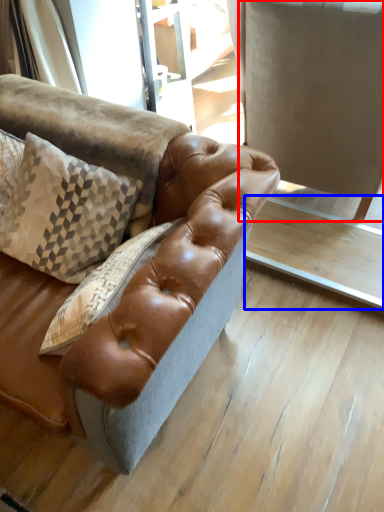
Question: Among these objects, which one is farthest to the camera, swivel chair (highlighted by a red box) or table (highlighted by a blue box)?

Choices:
 (A) swivel chair
 (B) table

Answer: (B)